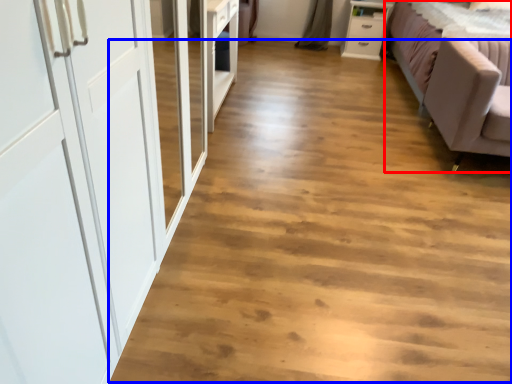
Question: Which point is further to the camera, studio couch (highlighted by a red box) or plain (highlighted by a blue box)?

Choices:
 (A) studio couch
 (B) plain

Answer: (A)